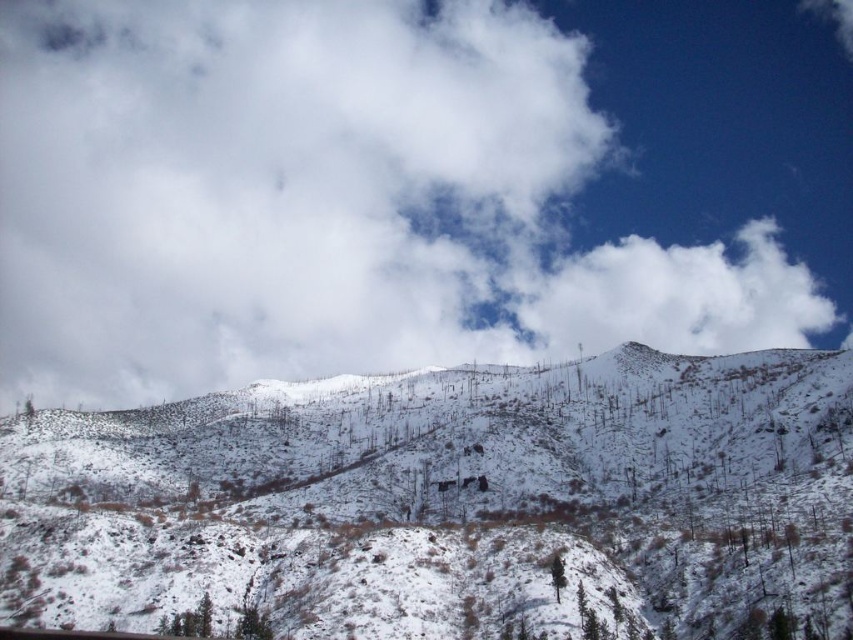
Question: Which point is farther to the camera?

Choices:
 (A) (173, 106)
 (B) (204, 456)

Answer: (A)

Question: In this image, where is white snow-covered hillside at center located relative to white fluffy cloud at upper right?

Choices:
 (A) above
 (B) below

Answer: (B)

Question: Which point appears closest to the camera in this image?

Choices:
 (A) (415, 627)
 (B) (567, 266)
 (C) (33, 195)

Answer: (A)

Question: Is white fluffy cloud at upper center to the right of white snow-covered hillside at center from the viewer's perspective?

Choices:
 (A) no
 (B) yes

Answer: (A)

Question: Which point is farther to the camera?

Choices:
 (A) (749, 419)
 (B) (277, 172)
 (C) (762, 316)

Answer: (C)

Question: Considering the relative positions of white fluffy cloud at upper center and white fluffy cloud at upper right in the image provided, where is white fluffy cloud at upper center located with respect to white fluffy cloud at upper right?

Choices:
 (A) above
 (B) below

Answer: (A)